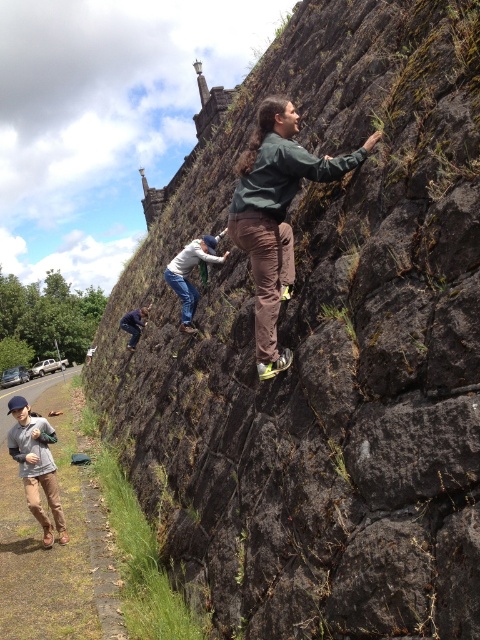
You are standing at the base of the rock climbing wall and want to reach a specific point marked at coordinates point (x=275, y=268). If your current position is 10 feet away from this point, how much farther do you need to move forward to reach it?

The point (x=275, y=268) is 19.76 feet from the viewer. Since you are currently 10 feet away, you need to move forward an additional 9.76 feet to reach it.

You are a climber looking at the rock wall and see two points marked on it. One is at coordinate point (244, 205) and the other is at point (29, 449). Which point is closer to you?

Point (244, 205) is closer to the viewer than point (29, 449).

You are a photographer standing at the base of the rock wall. You want to take a photo of the green fabric jacket at center and the khaki cotton pants at lower left. Which one is positioned higher up on the wall?

The green fabric jacket at center is positioned higher up on the wall than the khaki cotton pants at lower left.